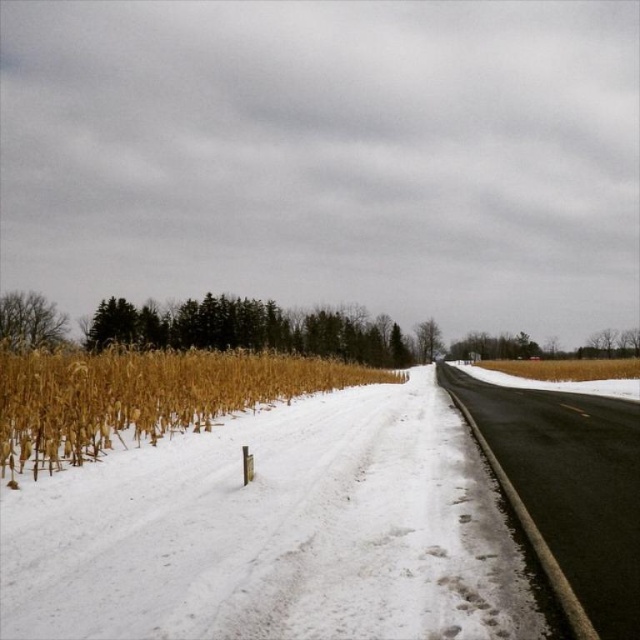
You are a snowplow driver needing to clear the road. You see the golden dry corn at left and the black asphalt highway at center. Which area requires immediate attention for snow removal?

The black asphalt highway at center requires immediate attention for snow removal because it is the road that needs to be cleared for safe travel, while the golden dry corn at left is not part of the road and does not need snow removal.

You are a bird flying over the rural winter scene. You see the bare branches at left and the green leafy tree at center. Which tree would you choose to land on if you want to find shelter from the cold wind? Explain your choice based on their positions.

The green leafy tree at center is to the right of the bare branches at left. Since the green leafy tree at center has leaves, it provides better shelter from the cold wind compared to the bare branches at left, which lack leaves for protection.

You are a farmer checking the winter crops. You see the golden dry corn at left and the black asphalt highway at center. Which of these two objects is larger in size?

The golden dry corn at left is bigger than the black asphalt highway at center.